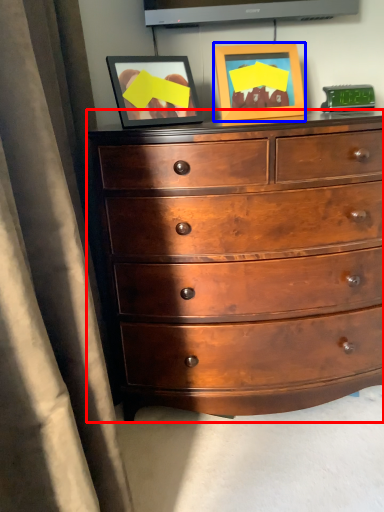
Question: Which point is closer to the camera, chest of drawers (highlighted by a red box) or picture frame (highlighted by a blue box)?

Choices:
 (A) chest of drawers
 (B) picture frame

Answer: (A)